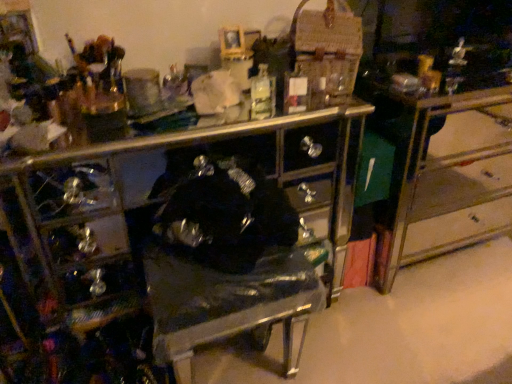
You are a GUI agent. You are given a task and a screenshot of the screen. Output one action in this format:
    pyautogui.click(x=<x>, y=<y>)
    Task: Click on the free spot below metallic silver table at center (from a real-world perspective)
    The image size is (512, 384).
    Given the screenshot: What is the action you would take?
    pyautogui.click(x=460, y=233)